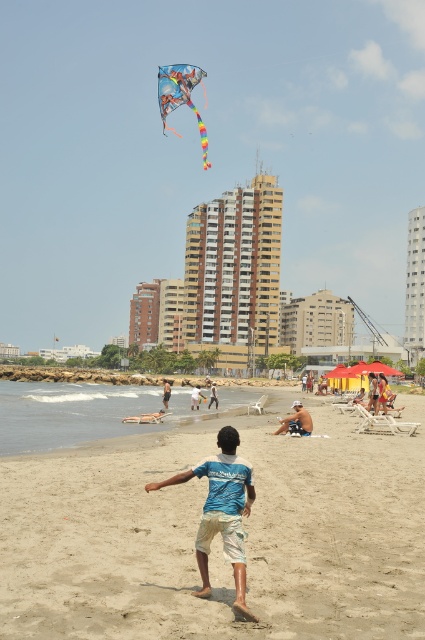
Question: Does blue cotton shirt at center have a lesser width compared to blue t-shirt at center?

Choices:
 (A) yes
 (B) no

Answer: (B)

Question: Can you confirm if tan shorts at lower center is wider than blue t-shirt at center?

Choices:
 (A) yes
 (B) no

Answer: (A)

Question: Which point is farther to the camera?

Choices:
 (A) (169, 109)
 (B) (280, 436)
 (C) (229, 449)

Answer: (B)

Question: Is blue cotton shirt at center positioned behind white cotton shorts at center?

Choices:
 (A) no
 (B) yes

Answer: (A)

Question: Which point is farther to the camera?

Choices:
 (A) (167, 387)
 (B) (149, 584)
 (C) (295, 433)

Answer: (A)

Question: Which object appears closest to the camera in this image?

Choices:
 (A) white cotton shorts at center
 (B) blue t-shirt at center

Answer: (A)